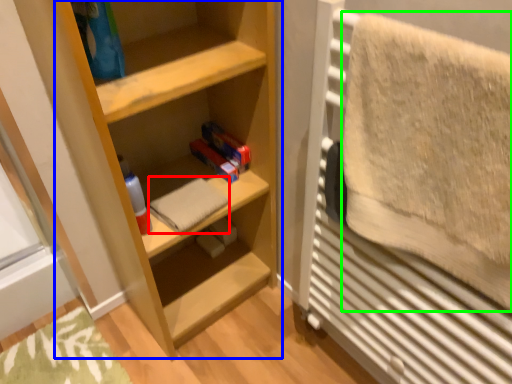
Question: Which object is the closest to the bath towel (highlighted by a red box)? Choose among these: shelf (highlighted by a blue box) or bath towel (highlighted by a green box).

Choices:
 (A) shelf
 (B) bath towel

Answer: (A)